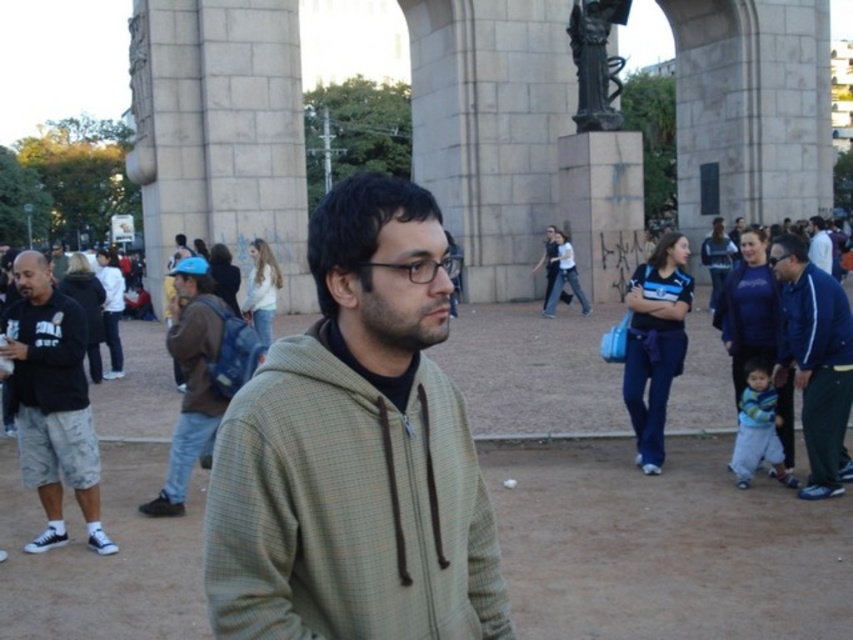
Question: Does light brown hooded sweatshirt at center appear on the left side of blue jacket at right?

Choices:
 (A) yes
 (B) no

Answer: (A)

Question: Based on their relative distances, which object is farther from the white fabric jacket at center?

Choices:
 (A) transparent plastic glasses at center
 (B) brown fabric jacket at left

Answer: (B)

Question: From the image, what is the correct spatial relationship of white fabric jacket at center in relation to matte black glasses at center?

Choices:
 (A) left
 (B) right

Answer: (B)

Question: Considering the relative positions of light brown hooded sweatshirt at center and brown fabric jacket at left in the image provided, where is light brown hooded sweatshirt at center located with respect to brown fabric jacket at left?

Choices:
 (A) below
 (B) above

Answer: (A)

Question: Which point appears farthest from the camera in this image?

Choices:
 (A) (86, 440)
 (B) (358, 305)

Answer: (A)

Question: Among these points, which one is nearest to the camera?

Choices:
 (A) (811, 237)
 (B) (776, 259)
 (C) (47, 307)
 (D) (184, 448)

Answer: (C)